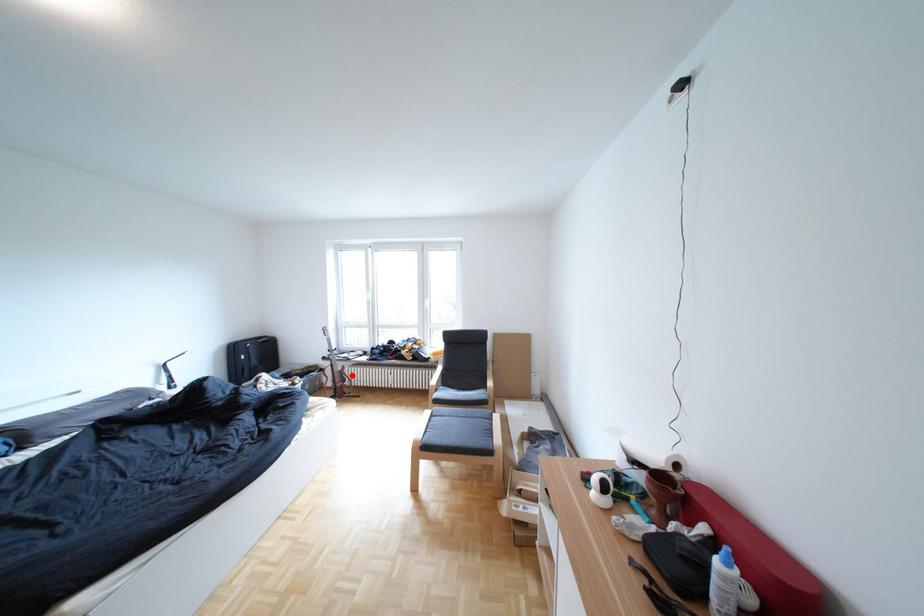
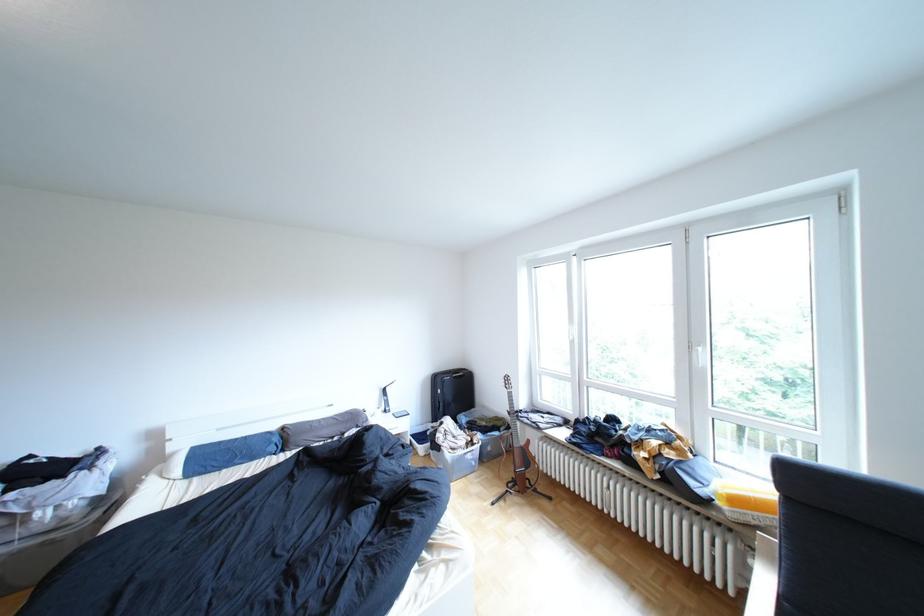
Question: I am providing you with two images of the same scene from different viewpoints. Image1 has a red point marked. In image2, the corresponding 3D location appears at what relative position? Reply with the corresponding letter.

Choices:
 (A) Closer
 (B) Farther

Answer: (A)